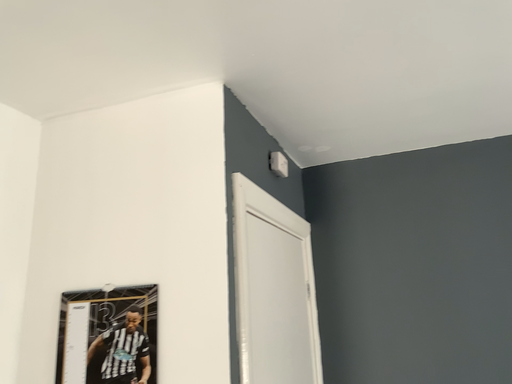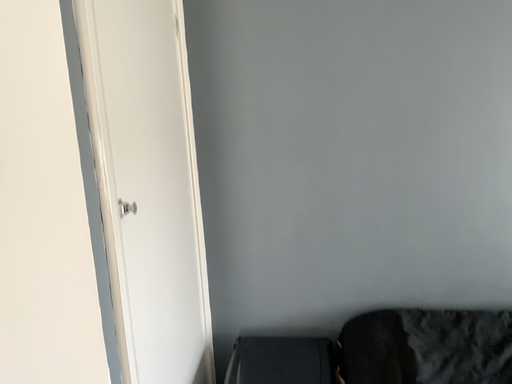
Question: Which way did the camera rotate in the video?

Choices:
 (A) rotated downward
 (B) rotated upward

Answer: (A)